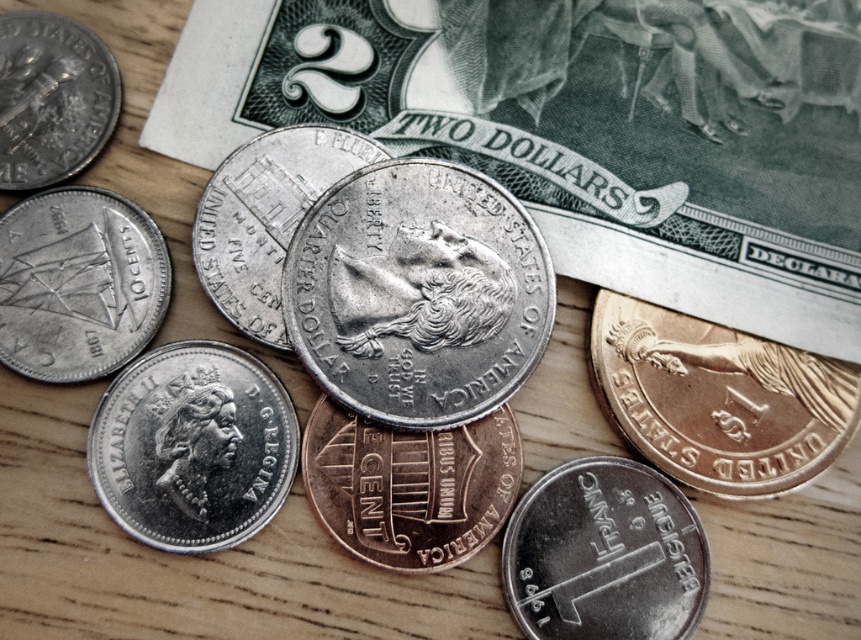
You are organizing coins on a wooden table and see the shiny silver coin at upper left and the satin silver quarter at center. Which coin is closer to you?

The shiny silver coin at upper left is behind the satin silver quarter at center, so the satin silver quarter at center is closer to you.